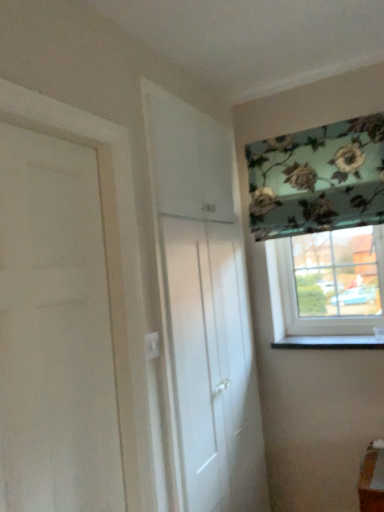
Question: Is black marble window sill at lower right bigger or smaller than clear glass window at right, placed as the 1th window when sorted from bottom to top?

Choices:
 (A) big
 (B) small

Answer: (B)

Question: Choose the correct answer: Is black marble window sill at lower right inside clear glass window at right, placed as the 1th window when sorted from bottom to top, or outside it?

Choices:
 (A) inside
 (B) outside

Answer: (B)

Question: Considering the real-world distances, which object is farthest from the floral fabric at upper right, placed as the second window when sorted from bottom to top?

Choices:
 (A) white glossy cabinet at center, which is the second door from front to back
 (B) black marble window sill at lower right
 (C) clear glass window at right, the second window in the top-to-bottom sequence
 (D) white matte door at left, the first door when ordered from left to right

Answer: (D)

Question: Considering the real-world distances, which object is farthest from the black marble window sill at lower right?

Choices:
 (A) white matte door at left, which is counted as the second door, starting from the back
 (B) white glossy cabinet at center, which is the second door from front to back
 (C) floral fabric at upper right, positioned as the first window in top-to-bottom order
 (D) clear glass window at right, the second window in the top-to-bottom sequence

Answer: (A)